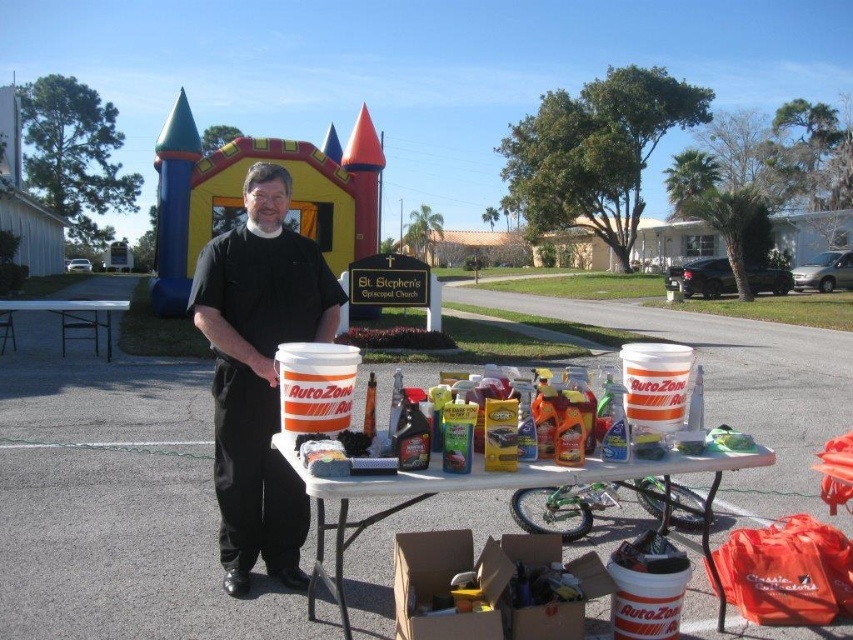
In the scene shown: Is black matte shirt at center wider than white plastic table at center?

Incorrect, black matte shirt at center's width does not surpass white plastic table at center's.

Does black matte shirt at center have a larger size compared to white plastic table at center?

No.

Which is in front, point (257, 440) or point (322, 536)?

Point (322, 536) is in front.

The height and width of the screenshot is (640, 853). What are the coordinates of `black matte shirt at center` in the screenshot? It's located at (259, 372).

Describe the element at coordinates (259, 372) in the screenshot. I see `black matte shirt at center` at that location.

Can you confirm if black matte shirt at center is positioned to the right of white plastic table at left?

Correct, you'll find black matte shirt at center to the right of white plastic table at left.

Is point (218, 365) positioned after point (94, 348)?

No, it is in front of (94, 348).

The image size is (853, 640). Find the location of `black matte shirt at center`. black matte shirt at center is located at coordinates (259, 372).

Describe the element at coordinates (468, 490) in the screenshot. This screenshot has height=640, width=853. I see `white plastic table at center` at that location.

This screenshot has height=640, width=853. Describe the element at coordinates (468, 490) in the screenshot. I see `white plastic table at center` at that location.

Where is `white plastic table at center`? This screenshot has width=853, height=640. white plastic table at center is located at coordinates (468, 490).